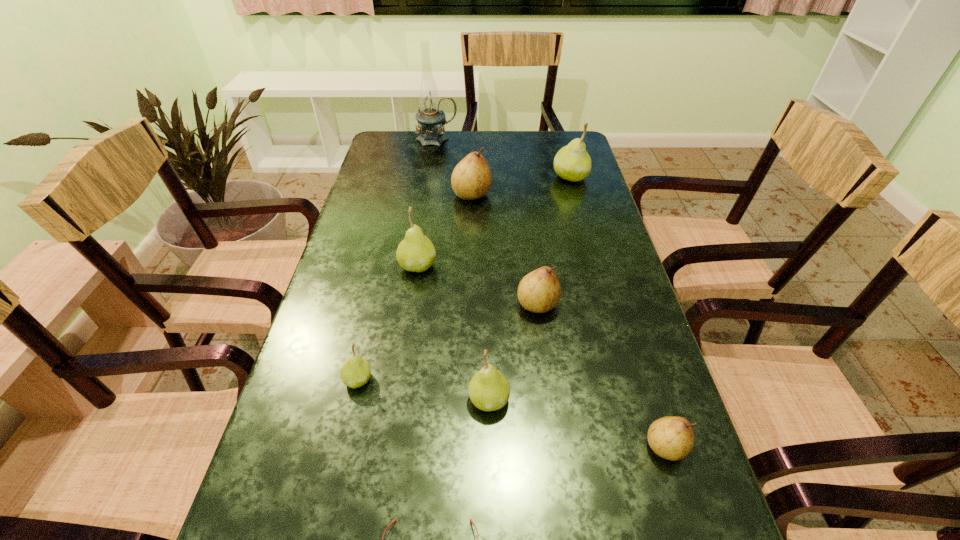
The image size is (960, 540). In order to click on oil lamp in this screenshot , I will do `click(430, 119)`.

Where is `the tallest object`? the tallest object is located at coordinates (430, 119).

Find the location of a particular element. The width and height of the screenshot is (960, 540). the rightmost green pear is located at coordinates (572, 162).

Locate an element on the screen. This screenshot has width=960, height=540. the tallest pear is located at coordinates (572, 162).

Where is `the leftmost brown pear`? The image size is (960, 540). the leftmost brown pear is located at coordinates (471, 179).

Where is `the farthest brown pear`? the farthest brown pear is located at coordinates (471, 179).

Where is `the sixth nearest object`? The image size is (960, 540). the sixth nearest object is located at coordinates (416, 253).

Find the location of `the second pear from left to right`. the second pear from left to right is located at coordinates (416, 253).

Identify the location of the second smallest brown pear. The height and width of the screenshot is (540, 960). (539, 291).

Where is `the seventh object from left to right`? Image resolution: width=960 pixels, height=540 pixels. the seventh object from left to right is located at coordinates (539, 291).